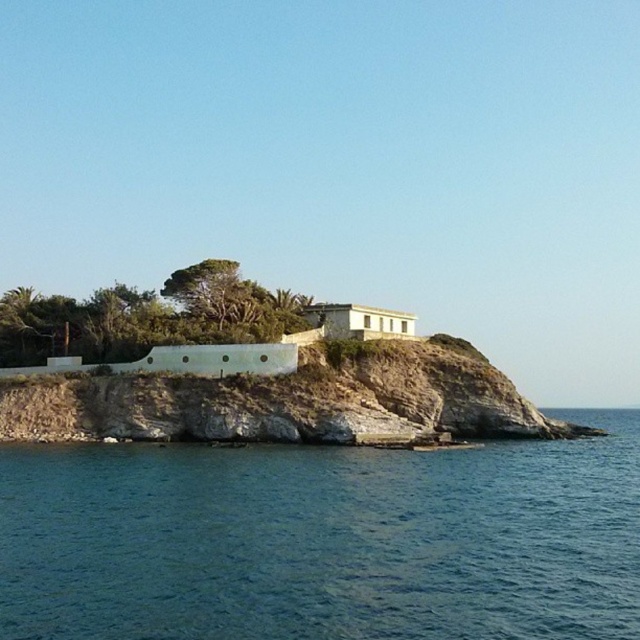
Is blue water at lower left to the right of brown rocky cliff at center from the viewer's perspective?

In fact, blue water at lower left is to the left of brown rocky cliff at center.

This screenshot has width=640, height=640. Identify the location of blue water at lower left. (323, 540).